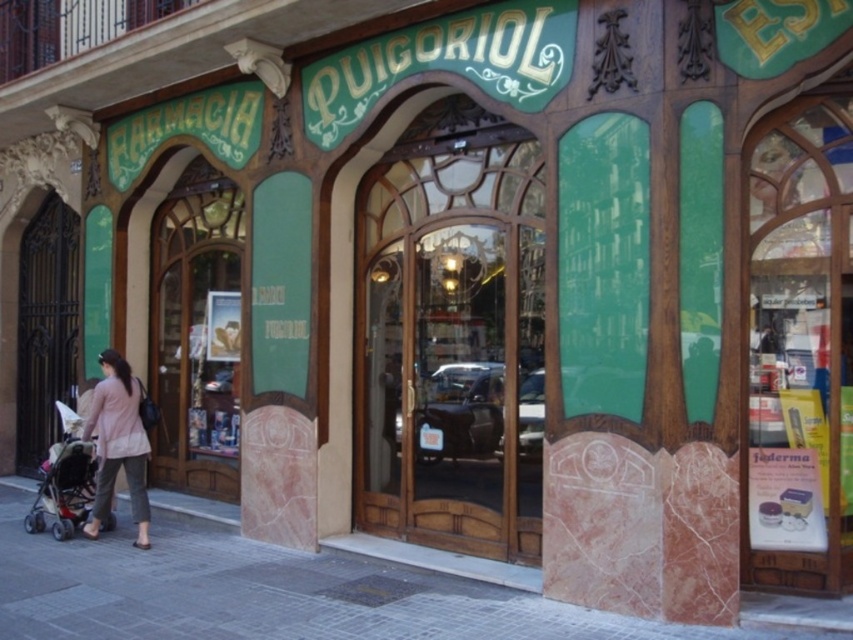
Question: Among these objects, which one is nearest to the camera?

Choices:
 (A) pink fabric at lower left
 (B) matte black stroller at lower left
 (C) wooden glass door at center
 (D) paved stone sidewalk at lower center

Answer: (C)

Question: In this image, where is paved stone sidewalk at lower center located relative to matte black stroller at lower left?

Choices:
 (A) below
 (B) above

Answer: (A)

Question: Among these points, which one is nearest to the camera?

Choices:
 (A) (135, 476)
 (B) (757, 628)
 (C) (93, 458)
 (D) (518, 371)

Answer: (B)

Question: Among these objects, which one is farthest from the camera?

Choices:
 (A) paved stone sidewalk at lower center
 (B) wooden glass door at center
 (C) matte black stroller at lower left
 (D) pink fabric at lower left

Answer: (C)

Question: In this image, where is paved stone sidewalk at lower center located relative to pink fabric at lower left?

Choices:
 (A) above
 (B) below

Answer: (B)

Question: Does wooden glass door at center appear on the right side of matte black stroller at lower left?

Choices:
 (A) no
 (B) yes

Answer: (B)